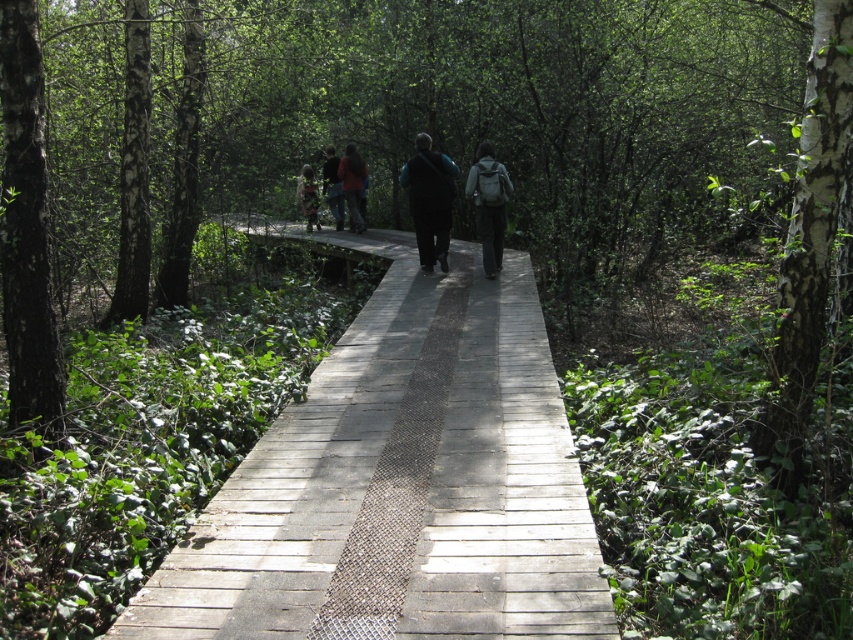
Question: Among these objects, which one is farthest from the camera?

Choices:
 (A) white bark tree at right
 (B) black matte jacket at center

Answer: (B)

Question: Can you confirm if wooden boardwalk at center is positioned below white bark tree at right?

Choices:
 (A) no
 (B) yes

Answer: (B)

Question: Considering the relative positions of white bark tree at right and smooth bark tree at left in the image provided, where is white bark tree at right located with respect to smooth bark tree at left?

Choices:
 (A) below
 (B) above

Answer: (A)

Question: Estimate the real-world distances between objects in this image. Which object is farther from the wooden boardwalk at center?

Choices:
 (A) dark blue jacket at center
 (B) black matte jacket at center

Answer: (A)

Question: Is dark blue jeans at center smaller than camouflage-patterned jacket at center?

Choices:
 (A) yes
 (B) no

Answer: (B)

Question: Which point is closer to the camera?

Choices:
 (A) pos(19,424)
 (B) pos(834,140)

Answer: (B)